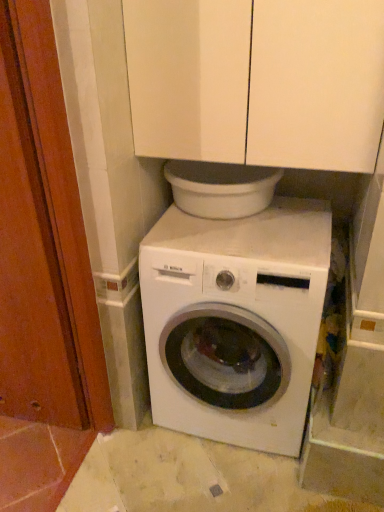
Question: Is white glossy washing machine at center wider or thinner than wooden screen door at left?

Choices:
 (A) wide
 (B) thin

Answer: (A)

Question: Is white glossy washing machine at center taller or shorter than wooden screen door at left?

Choices:
 (A) short
 (B) tall

Answer: (A)

Question: Which is farther from the concrete tile floor at center?

Choices:
 (A) white glossy washing machine at center
 (B) white matte cabinet at upper center
 (C) wooden screen door at left

Answer: (B)

Question: Considering the real-world distances, which object is farthest from the white glossy washing machine at center?

Choices:
 (A) wooden screen door at left
 (B) concrete tile floor at center
 (C) white matte cabinet at upper center

Answer: (A)